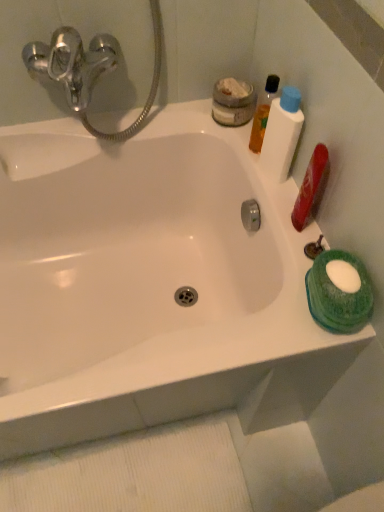
Where is `free space to the left of green sponge at right, placed as the first mouthwash when sorted from bottom to top`? free space to the left of green sponge at right, placed as the first mouthwash when sorted from bottom to top is located at coordinates (263, 327).